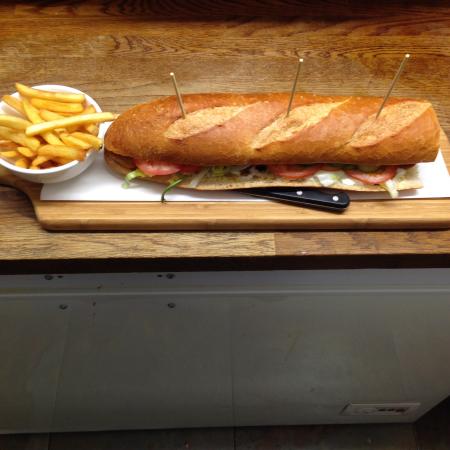
Image resolution: width=450 pixels, height=450 pixels. I want to click on 3 toothpicks, so click(393, 83), click(297, 84), click(183, 96).